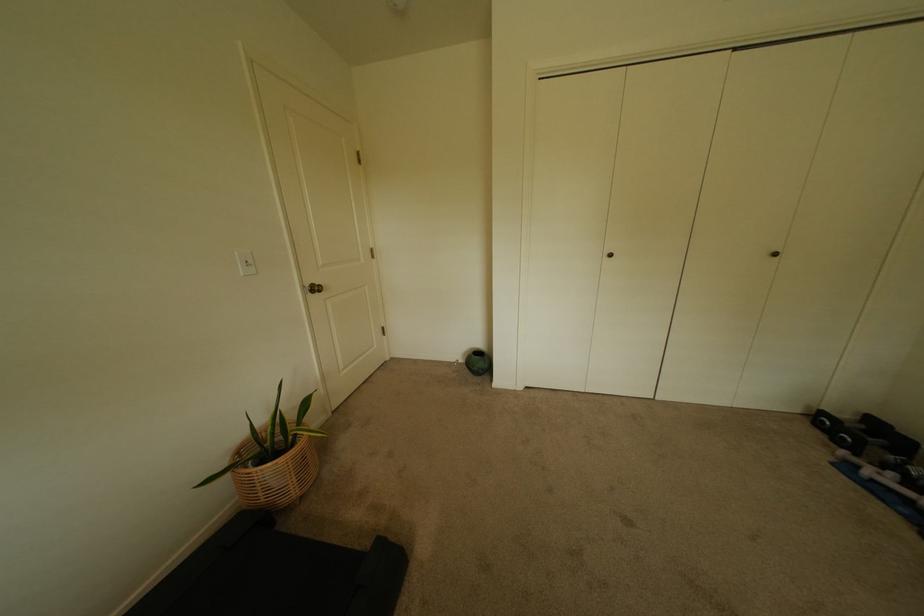
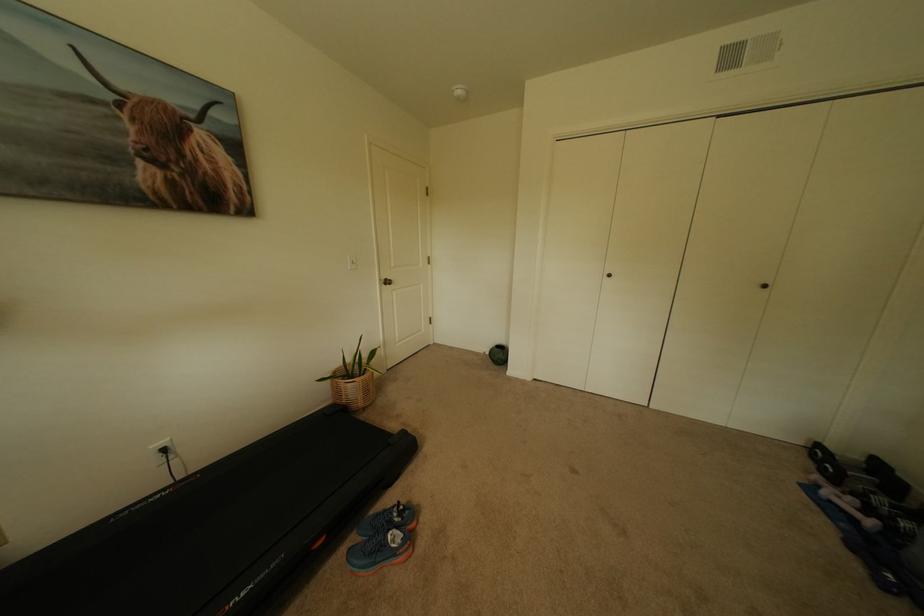
Find the pixel in the second image that matches the point at 463,362 in the first image.

(491, 353)